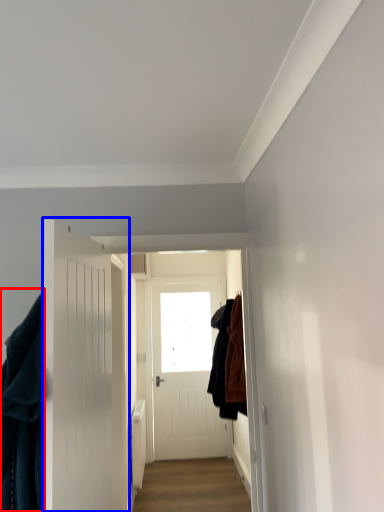
Question: Which object appears farthest to the camera in this image, clothing (highlighted by a red box) or door (highlighted by a blue box)?

Choices:
 (A) clothing
 (B) door

Answer: (A)